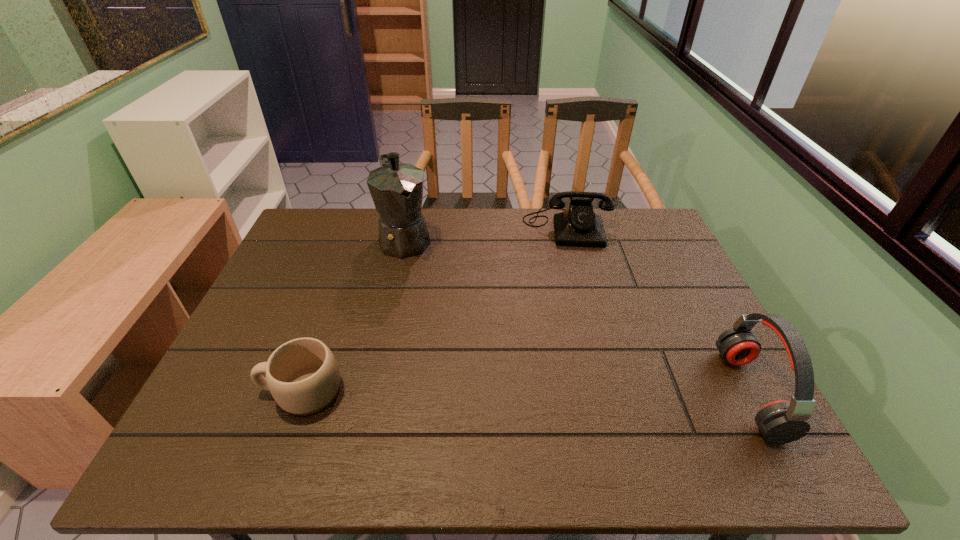
Where is `empty location between the telephone and the mug`? The width and height of the screenshot is (960, 540). empty location between the telephone and the mug is located at coordinates (434, 309).

Find the location of a particular element. Image resolution: width=960 pixels, height=540 pixels. empty space between the telephone and the mug is located at coordinates (434, 309).

The height and width of the screenshot is (540, 960). What are the coordinates of `unoccupied area between the third shortest object and the coffeepot` in the screenshot? It's located at (578, 316).

Find the location of `vacant region between the third shortest object and the coffeepot`. vacant region between the third shortest object and the coffeepot is located at coordinates (578, 316).

I want to click on free space that is in between the second tallest object and the tallest object, so click(578, 316).

The width and height of the screenshot is (960, 540). Identify the location of object identified as the second closest to the coffeepot. (302, 375).

Identify the location of object that is the closest one to the tallest object. Image resolution: width=960 pixels, height=540 pixels. (578, 225).